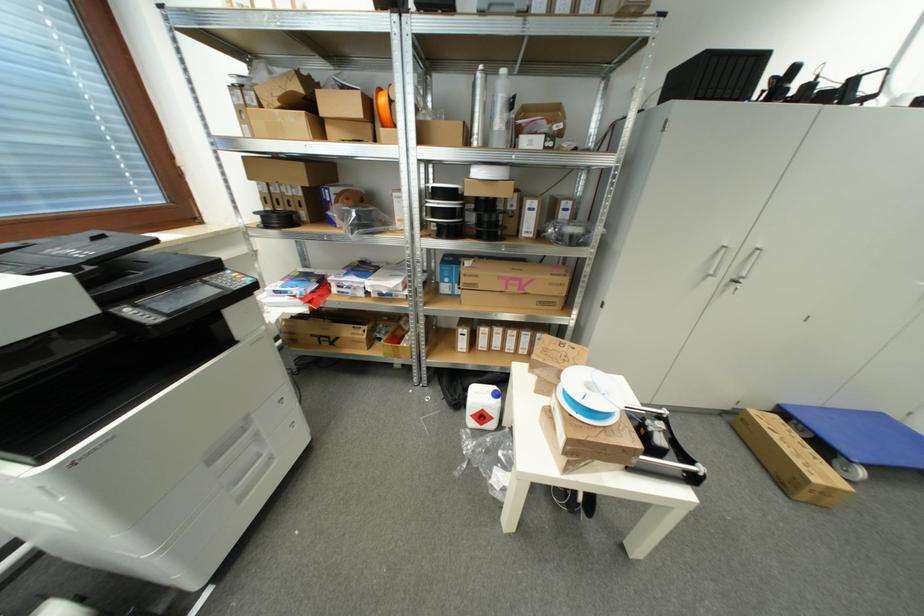
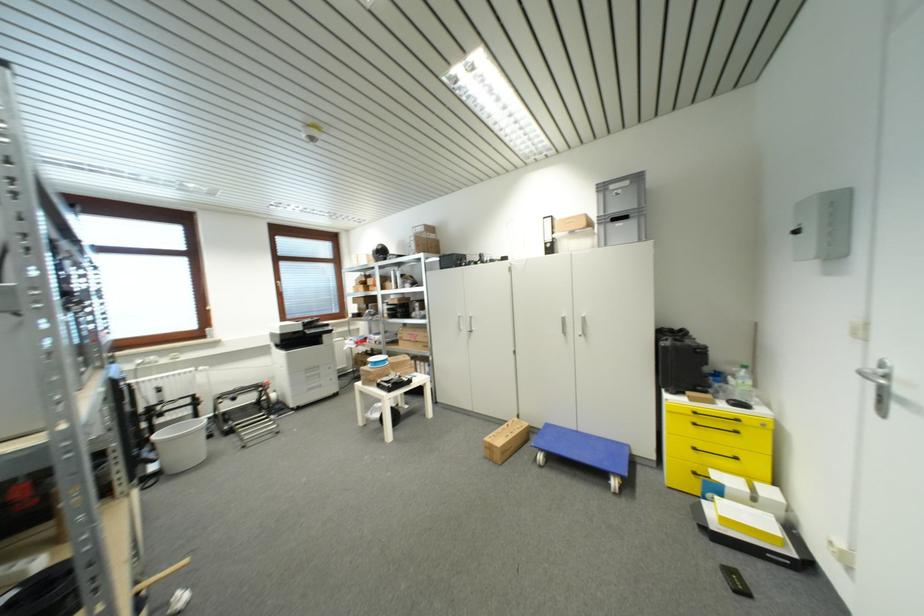
Where in the second image is the point corresponding to (783,408) from the first image?

(552, 427)